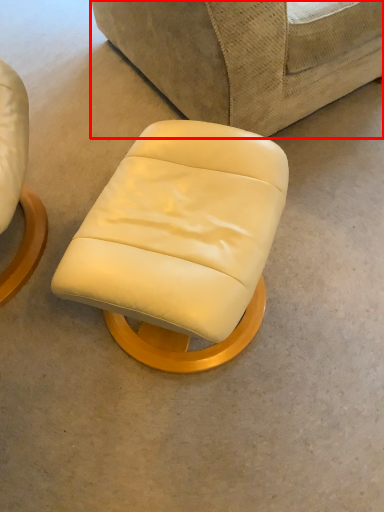
Question: From the image's perspective, considering the relative positions of studio couch (annotated by the red box) and chair in the image provided, where is studio couch (annotated by the red box) located with respect to the staircase?

Choices:
 (A) above
 (B) below

Answer: (A)